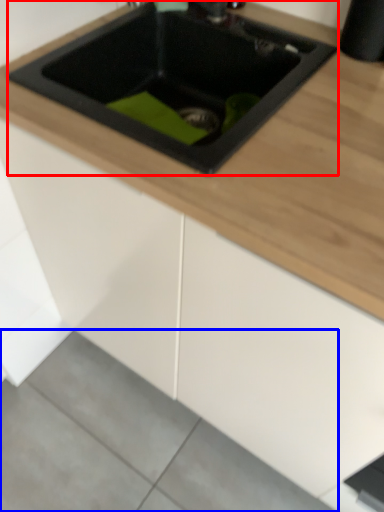
Question: Which object is further to the camera taking this photo, sink (highlighted by a red box) or concrete (highlighted by a blue box)?

Choices:
 (A) sink
 (B) concrete

Answer: (B)